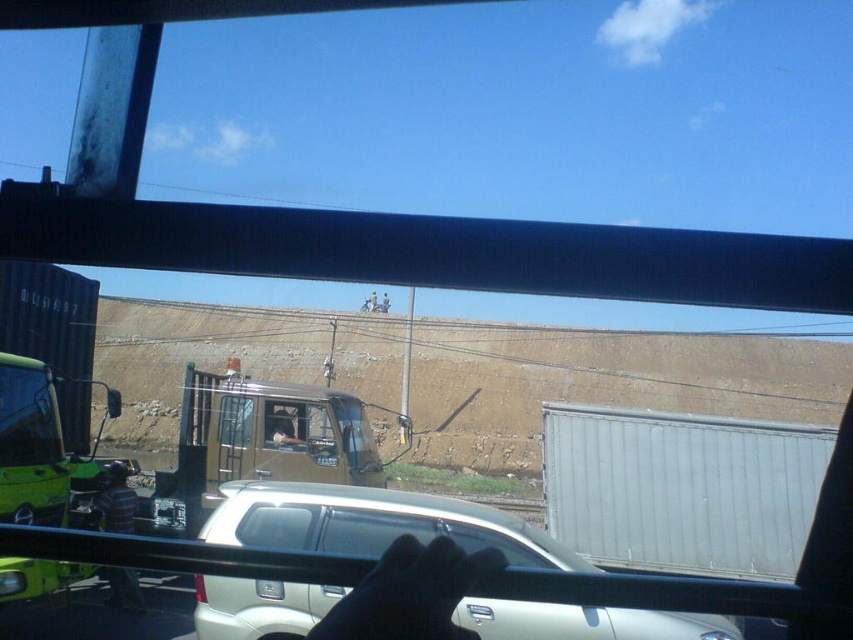
Question: Estimate the real-world distances between objects in this image. Which object is farther from the transparent glass window at center?

Choices:
 (A) green matte windshield at left
 (B) striped shirt at lower left

Answer: (A)

Question: Does green matte windshield at left appear over transparent glass car window at center?

Choices:
 (A) no
 (B) yes

Answer: (B)

Question: Which object appears farthest from the camera in this image?

Choices:
 (A) transparent glass car window at center
 (B) light brown leather jacket at center
 (C) green matte windshield at left

Answer: (B)

Question: Which of the following is the closest to the observer?

Choices:
 (A) transparent glass car window at center
 (B) light brown leather jacket at center
 (C) white matte car at center

Answer: (A)

Question: Does striped shirt at lower left appear on the left side of light brown leather jacket at center?

Choices:
 (A) no
 (B) yes

Answer: (B)

Question: Can you confirm if black leather glove at lower center is thinner than light brown leather jacket at center?

Choices:
 (A) yes
 (B) no

Answer: (A)